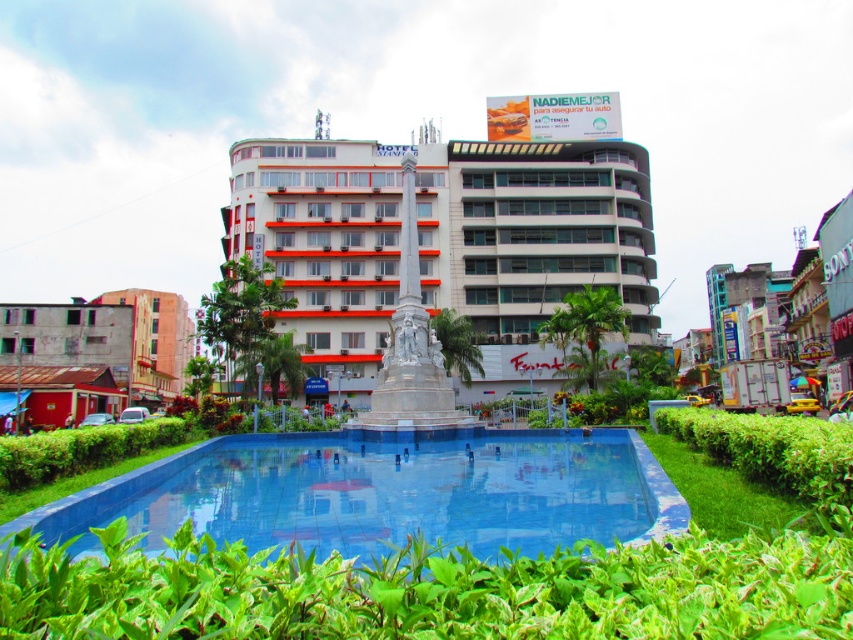
Is white glossy building at center below blue tile pool at center?

No, white glossy building at center is not below blue tile pool at center.

Can you confirm if white glossy building at center is positioned to the left of blue tile pool at center?

No, white glossy building at center is not to the left of blue tile pool at center.

Which is behind, point (276, 161) or point (117, 504)?

The point (276, 161) is behind.

Where is `white glossy building at center`? The image size is (853, 640). white glossy building at center is located at coordinates (444, 243).

From the picture: Does white glossy building at center lie in front of rusty metal building at left?

Yes, it is in front of rusty metal building at left.

In the scene shown: Between white glossy building at center and rusty metal building at left, which one appears on the right side from the viewer's perspective?

white glossy building at center

Is point (310, 198) in front of point (41, 328)?

Yes, it is in front of point (41, 328).

You are a GUI agent. You are given a task and a screenshot of the screen. Output one action in this format:
    pyautogui.click(x=<x>, y=<y>)
    Task: Click on the white glossy building at center
    The height and width of the screenshot is (640, 853).
    Given the screenshot: What is the action you would take?
    pyautogui.click(x=444, y=243)

What do you see at coordinates (383, 493) in the screenshot?
I see `blue tile pool at center` at bounding box center [383, 493].

How distant is blue tile pool at center from rusty metal building at left?

blue tile pool at center is 59.81 meters from rusty metal building at left.

Which is in front, point (419, 468) or point (183, 381)?

Point (419, 468) is more forward.

The height and width of the screenshot is (640, 853). What are the coordinates of `blue tile pool at center` in the screenshot? It's located at (383, 493).